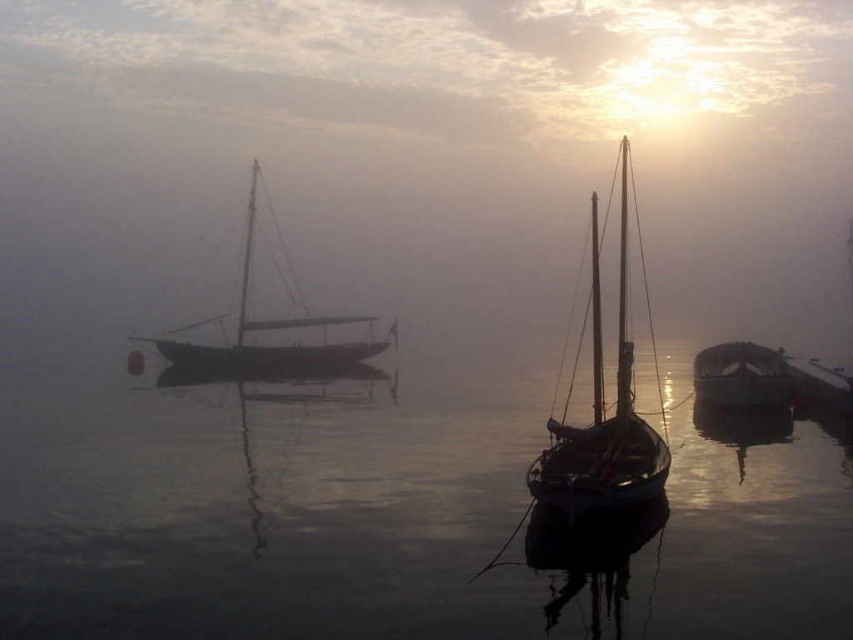
Is shiny dark wood sailboat at center taller than shiny dark wood boat at right?

Yes.

Is point (581, 500) positioned after point (752, 396)?

No, it is not.

At what (x,y) coordinates should I click in order to perform the action: click on shiny dark wood sailboat at center. Please return your answer as a coordinate pair (x, y). Looking at the image, I should click on (602, 416).

Who is taller, transparent water at center or wooden sailboat at left?

wooden sailboat at left is taller.

Which is behind, point (448, 464) or point (263, 369)?

The point (263, 369) is more distant.

Where is `transparent water at center`? This screenshot has height=640, width=853. transparent water at center is located at coordinates (381, 515).

Can you confirm if transparent water at center is positioned above shiny dark wood boat at right?

No, transparent water at center is not above shiny dark wood boat at right.

Is the position of transparent water at center more distant than that of shiny dark wood boat at right?

No, transparent water at center is in front of shiny dark wood boat at right.

Find the location of a particular element. The width and height of the screenshot is (853, 640). transparent water at center is located at coordinates (381, 515).

Find the location of a particular element. transparent water at center is located at coordinates (381, 515).